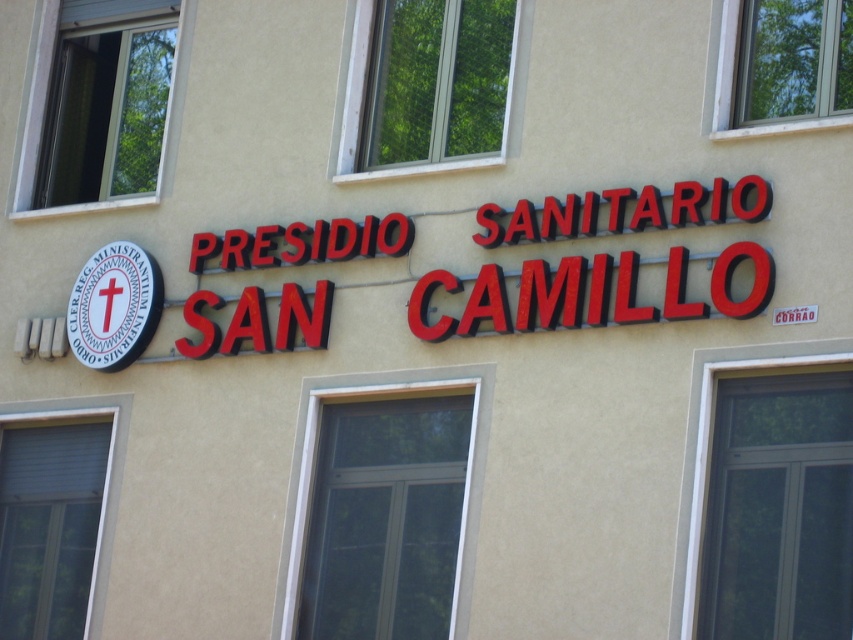
Does red plastic sign at center appear on the right side of white matte circular sign at left?

Correct, you'll find red plastic sign at center to the right of white matte circular sign at left.

Which is in front, point (570, 300) or point (111, 323)?

Point (570, 300) is in front.

Image resolution: width=853 pixels, height=640 pixels. Find the location of `red plastic sign at center`. red plastic sign at center is located at coordinates (554, 296).